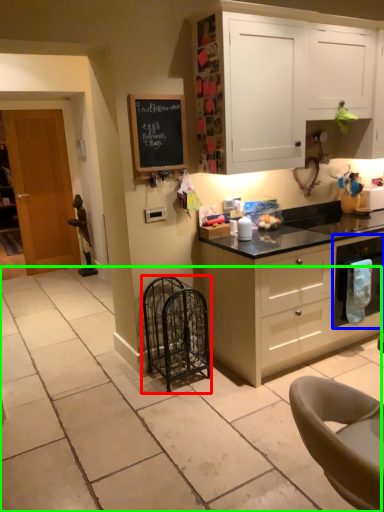
Question: Which object is positioned farthest from cage (highlighted by a red box)? Select from kitchen appliance (highlighted by a blue box) and granite (highlighted by a green box).

Choices:
 (A) kitchen appliance
 (B) granite

Answer: (A)